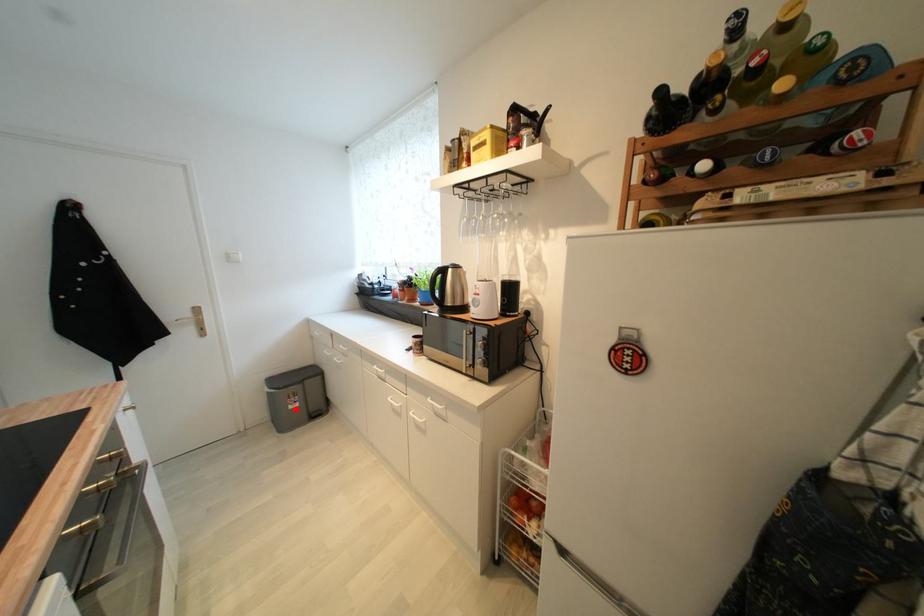
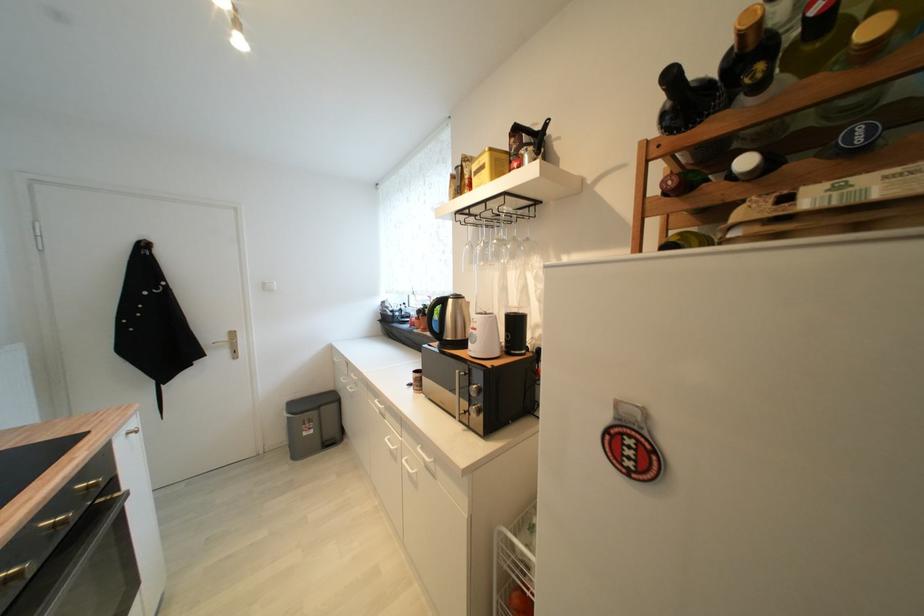
Question: A red point is marked in image1. In image2, is the corresponding 3D point closer to the camera or farther? Reply with the corresponding letter.

Choices:
 (A) The corresponding 3D point is closer.
 (B) The corresponding 3D point is farther.

Answer: (B)